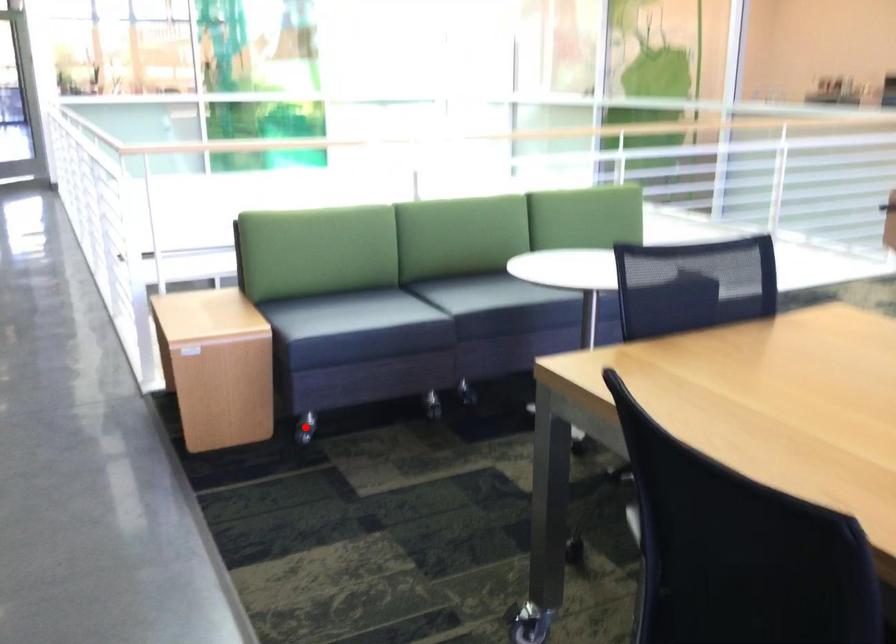
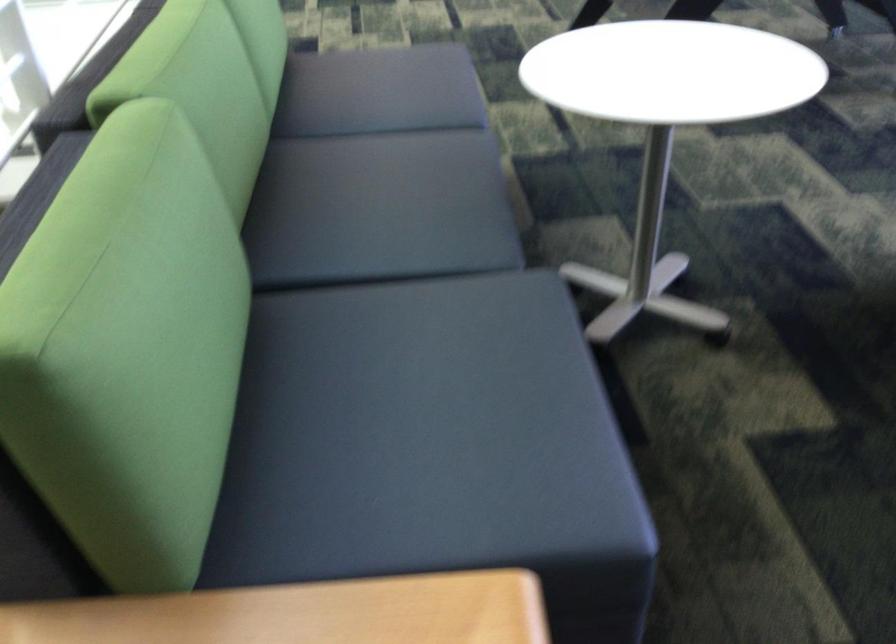
Question: I am providing you with two images of the same scene from different viewpoints. A red point is marked on the first image. Can you still see the location of the red point in image 2?

Choices:
 (A) Yes
 (B) No

Answer: (B)